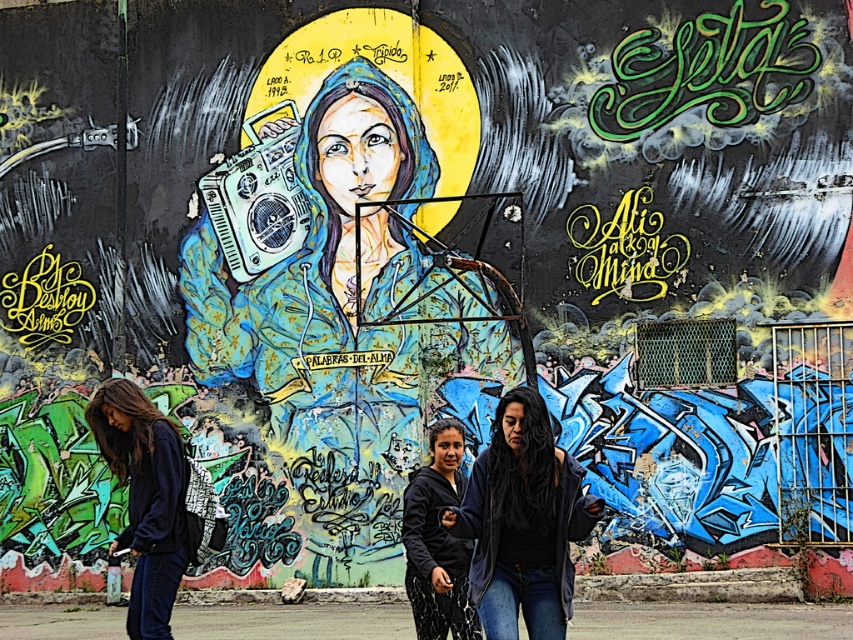
You are a photographer wanting to capture the metallic blue boombox at center and dark blue denim jeans at center in a single frame. Based on their heights, which object should you focus on first to ensure both are in focus?

The dark blue denim jeans at center has a lesser height compared to metallic blue boombox at center, so you should focus on the metallic blue boombox at center first to ensure both are in focus.